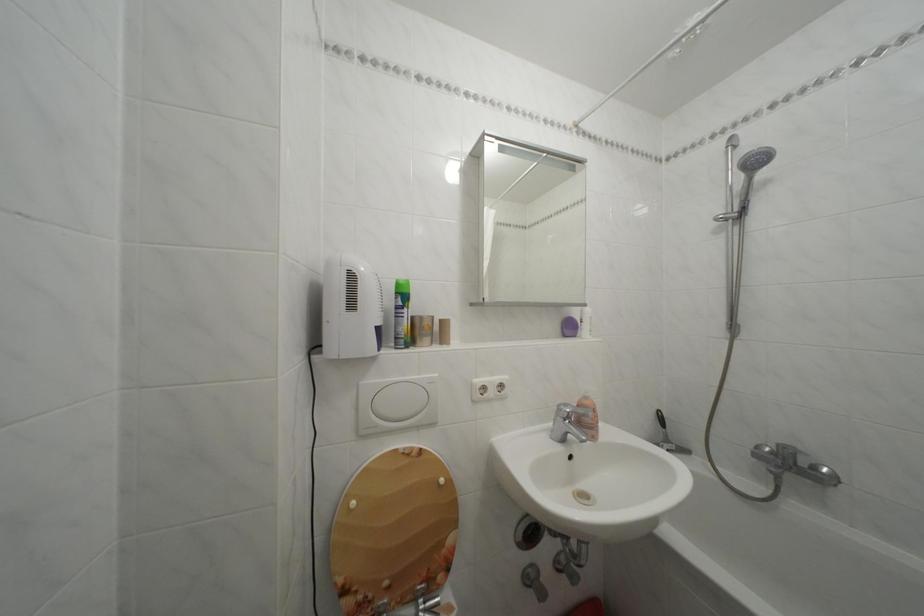
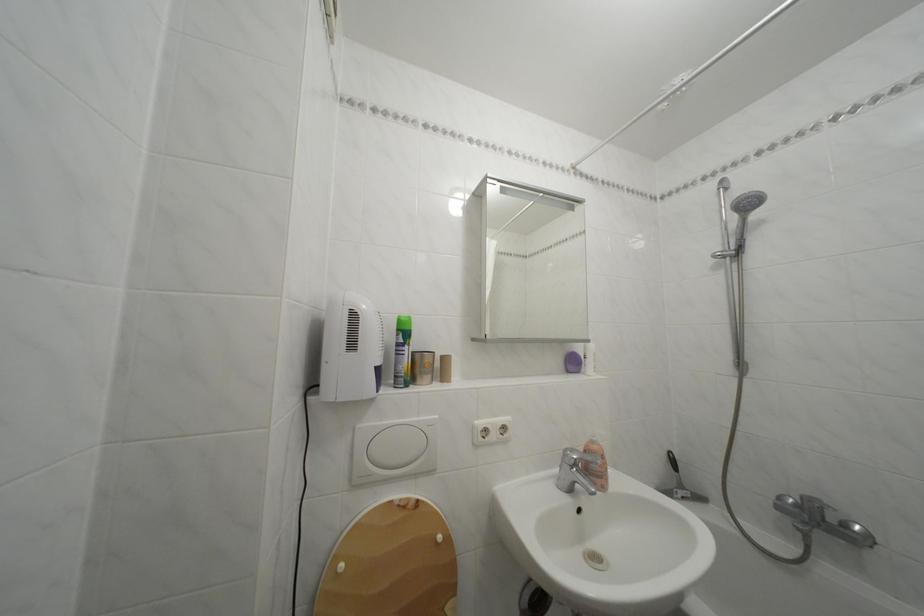
Locate, in the second image, the point that corresponds to (x=575, y=411) in the first image.

(581, 456)